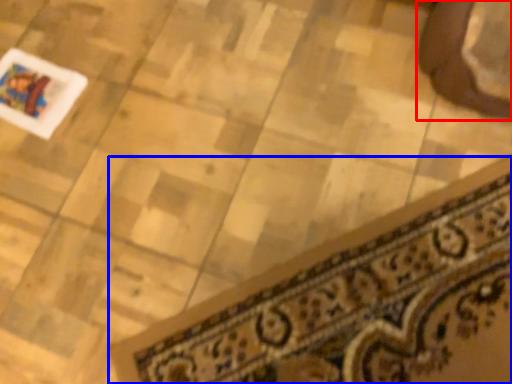
Question: Which point is further to the camera, footwear (highlighted by a red box) or doormat (highlighted by a blue box)?

Choices:
 (A) footwear
 (B) doormat

Answer: (A)